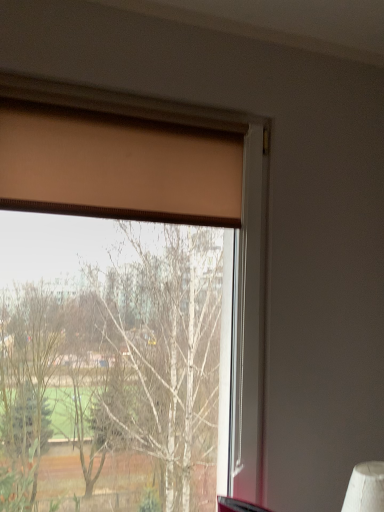
Question: Would you say matte brown curtain at upper left is a long distance from matte brown curtain at upper left?

Choices:
 (A) yes
 (B) no

Answer: (B)

Question: Is matte brown curtain at upper left thinner than matte brown curtain at upper left?

Choices:
 (A) no
 (B) yes

Answer: (A)

Question: Is matte brown curtain at upper left facing towards matte brown curtain at upper left?

Choices:
 (A) no
 (B) yes

Answer: (B)

Question: Considering the relative sizes of matte brown curtain at upper left and matte brown curtain at upper left in the image provided, is matte brown curtain at upper left bigger than matte brown curtain at upper left?

Choices:
 (A) yes
 (B) no

Answer: (A)

Question: Considering the relative sizes of matte brown curtain at upper left and matte brown curtain at upper left in the image provided, is matte brown curtain at upper left taller than matte brown curtain at upper left?

Choices:
 (A) no
 (B) yes

Answer: (B)

Question: Is matte brown curtain at upper left next to matte brown curtain at upper left?

Choices:
 (A) no
 (B) yes

Answer: (B)

Question: Can you confirm if matte brown curtain at upper left is wider than matte brown curtain at upper left?

Choices:
 (A) yes
 (B) no

Answer: (B)

Question: Is matte brown curtain at upper left closer to the viewer compared to matte brown curtain at upper left?

Choices:
 (A) no
 (B) yes

Answer: (A)

Question: Is matte brown curtain at upper left not inside matte brown curtain at upper left?

Choices:
 (A) yes
 (B) no

Answer: (B)

Question: Can you confirm if matte brown curtain at upper left is positioned to the right of matte brown curtain at upper left?

Choices:
 (A) no
 (B) yes

Answer: (A)

Question: Does matte brown curtain at upper left turn towards matte brown curtain at upper left?

Choices:
 (A) yes
 (B) no

Answer: (A)

Question: From a real-world perspective, is matte brown curtain at upper left positioned under matte brown curtain at upper left based on gravity?

Choices:
 (A) yes
 (B) no

Answer: (B)

Question: In terms of width, does matte brown curtain at upper left look wider or thinner when compared to matte brown curtain at upper left?

Choices:
 (A) wide
 (B) thin

Answer: (A)